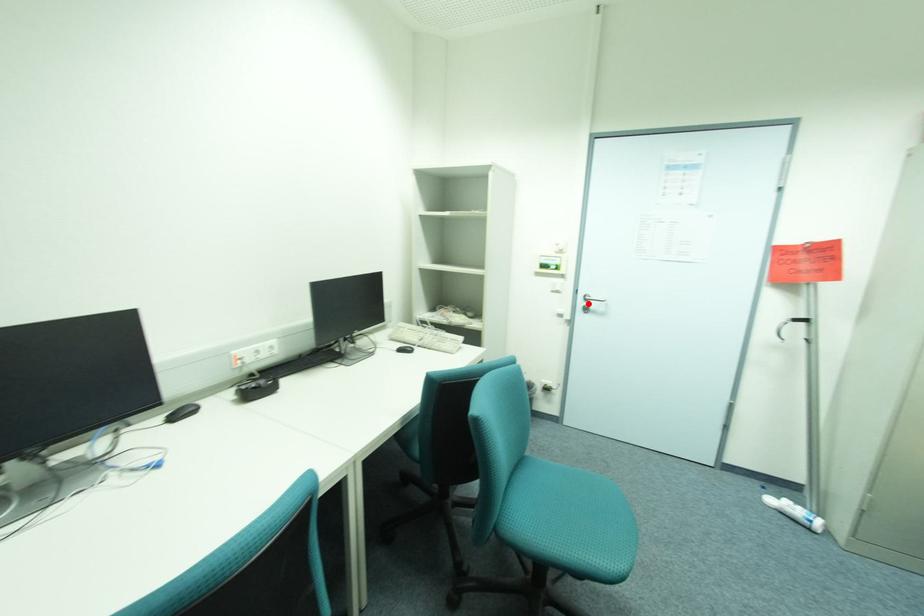
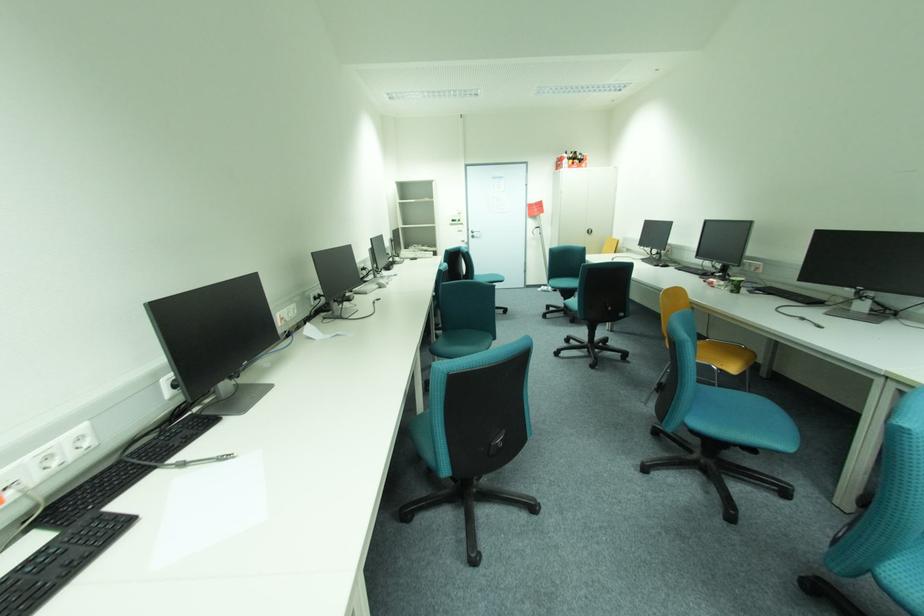
In the second image, find the point that corresponds to the highlighted location in the first image.

(477, 235)